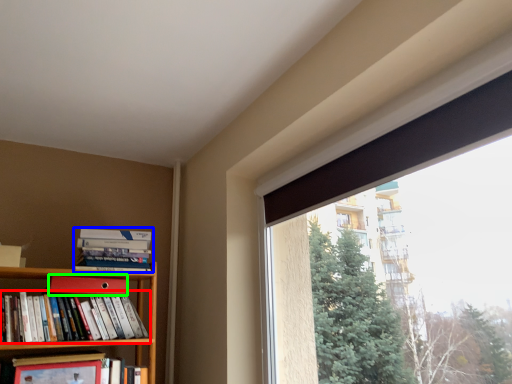
Question: Based on their relative distances, which object is farther from book (highlighted by a red box)? Choose from book (highlighted by a blue box) and paperback book (highlighted by a green box).

Choices:
 (A) book
 (B) paperback book

Answer: (A)